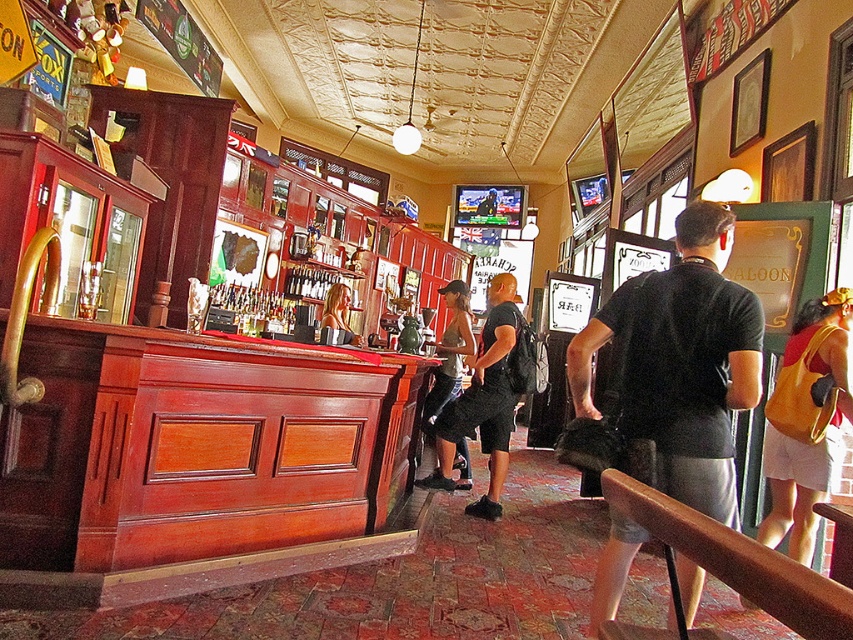
Consider the image. You are a bartender who just finished your shift and need to put away your belongings. You have an orange fabric bag at right and denim shorts at center. The bar counter is on the left. Can you reach both items from your current position at the bar counter without moving more than 2 meters?

The orange fabric bag at right is 2.30 meters away from denim shorts at center. Since the distance between them is over 2 meters, you cannot reach both items without moving more than 2 meters.

You are a customer at the bar and want to order a drink. You notice a black matte shirt at center and denim shorts at center. Which item is located to the right of the other?

The black matte shirt at center is positioned on the right side of denim shorts at center.